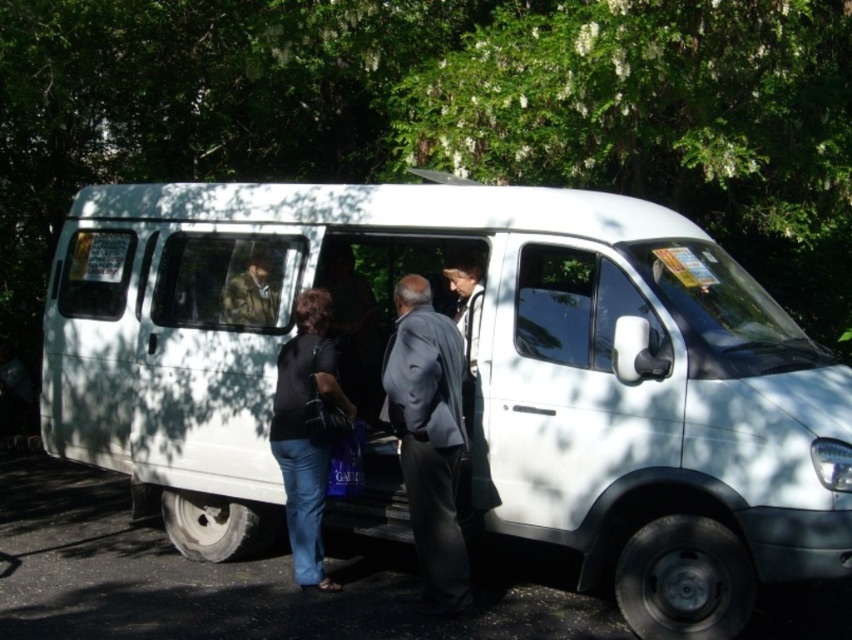
You are standing at the rear sliding door of the white van and want to walk towards the shaded area. There are two points marked on the ground in front of you. The first point is at coordinate point (406, 305) and the second point is at coordinate point (308, 349). Which point is closer to you as you exit the van?

Point (406, 305) is in front of point (308, 349), so the first point is closer to you as you exit the van.

You are a delivery person who needs to load a large package into the white matte van at center. You see the camouflage fabric jacket at center nearby. Can you fit both the package and the jacket inside the van?

The white matte van at center is larger in size than the camouflage fabric jacket at center, so yes, both the package and the jacket can fit inside the van as there is sufficient space.